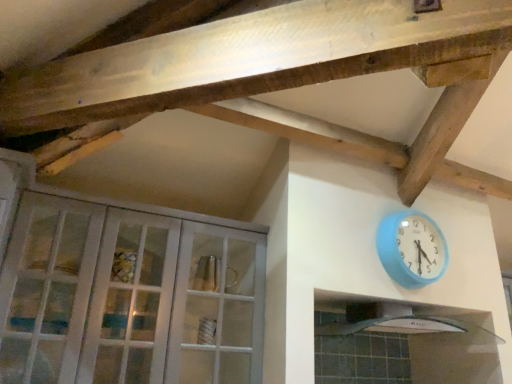
Question: From the image's perspective, would you say blue plastic wall clock at upper right is shown under white glass cabinet at left?

Choices:
 (A) no
 (B) yes

Answer: (A)

Question: From a real-world perspective, is blue plastic wall clock at upper right positioned under white glass cabinet at left based on gravity?

Choices:
 (A) no
 (B) yes

Answer: (A)

Question: Is the depth of blue plastic wall clock at upper right less than that of white glass cabinet at left?

Choices:
 (A) no
 (B) yes

Answer: (A)

Question: Is blue plastic wall clock at upper right next to white glass cabinet at left and touching it?

Choices:
 (A) yes
 (B) no

Answer: (B)

Question: Is white glass cabinet at left inside blue plastic wall clock at upper right?

Choices:
 (A) yes
 (B) no

Answer: (B)

Question: Is blue plastic wall clock at upper right wider than white glass cabinet at left?

Choices:
 (A) no
 (B) yes

Answer: (A)

Question: Can white glass cabinet at left be found inside white glossy exhaust hood at lower right?

Choices:
 (A) yes
 (B) no

Answer: (B)

Question: Does white glossy exhaust hood at lower right have a smaller size compared to white glass cabinet at left?

Choices:
 (A) yes
 (B) no

Answer: (A)

Question: Is white glossy exhaust hood at lower right wider than white glass cabinet at left?

Choices:
 (A) no
 (B) yes

Answer: (B)

Question: Does white glossy exhaust hood at lower right have a lesser width compared to white glass cabinet at left?

Choices:
 (A) no
 (B) yes

Answer: (A)

Question: Is white glossy exhaust hood at lower right facing towards white glass cabinet at left?

Choices:
 (A) no
 (B) yes

Answer: (A)

Question: From a real-world perspective, is white glossy exhaust hood at lower right on top of white glass cabinet at left?

Choices:
 (A) no
 (B) yes

Answer: (A)

Question: Is white glossy exhaust hood at lower right not near blue plastic wall clock at upper right?

Choices:
 (A) no
 (B) yes

Answer: (A)